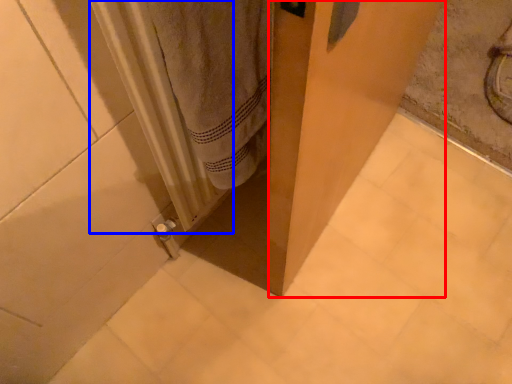
Question: Which of the following is the closest to the observer, screen door (highlighted by a red box) or radiator (highlighted by a blue box)?

Choices:
 (A) screen door
 (B) radiator

Answer: (A)